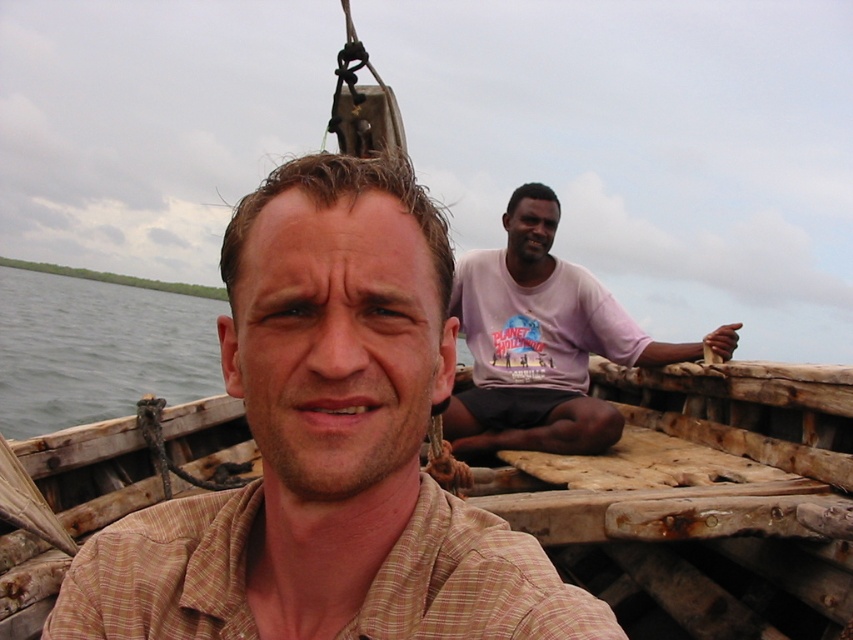
You are a photographer trying to capture a clear shot of the weathered wood boat at center and the pink cotton shirt at upper right. Since you want the boat to appear larger in the photo, which object should you move closer to the camera?

To make the weathered wood boat at center appear larger in the photo, you should move the weathered wood boat at center closer to the camera because it has a lesser height compared to the pink cotton shirt at upper right, so moving it closer would magnify its size in the frame.

You are standing on a dock and want to board the weathered wood boat at center. The dock has a wooden platform that extends 8 feet from the shore. Can you safely step onto the boat from the end of the dock?

The weathered wood boat at center is 7.96 feet away from the camera. Since the dock extends 8 feet, you can safely step onto the boat from the end of the dock as the distance is slightly less than the dock length.